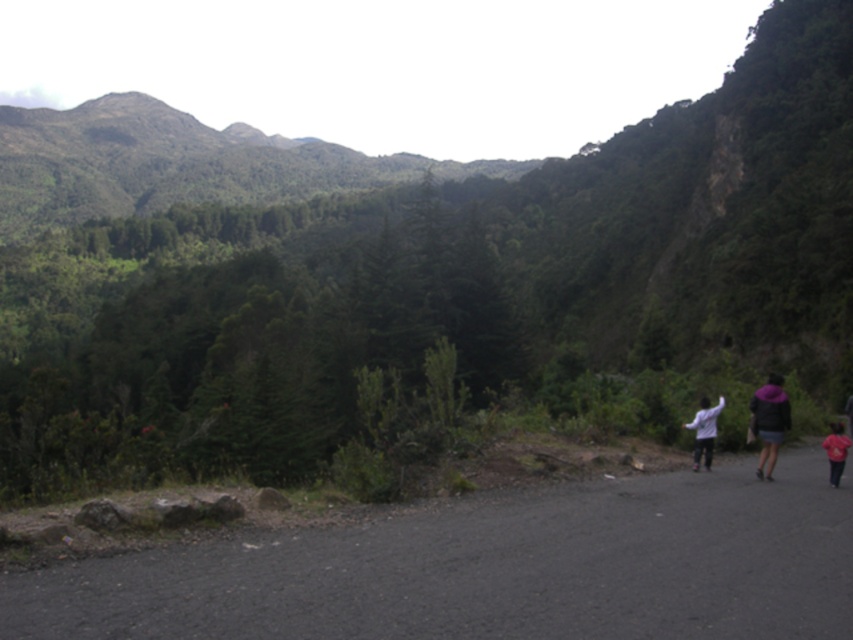
Does white matte jacket at center-right have a smaller size compared to red cotton shirt at right?

Yes.

What do you see at coordinates (704, 429) in the screenshot? I see `white matte jacket at center-right` at bounding box center [704, 429].

Which is in front, point (706, 410) or point (834, 428)?

Point (834, 428) is in front.

Identify the location of white matte jacket at center-right. (704, 429).

Who is more forward, (x=262, y=548) or (x=698, y=456)?

Positioned in front is point (x=262, y=548).

From the picture: Which of these two, black asphalt road at center or white matte jacket at center-right, stands shorter?

black asphalt road at center

Measure the distance between point [354,579] and camera.

The distance of point [354,579] from camera is 6.75 meters.

This screenshot has width=853, height=640. Find the location of `black asphalt road at center`. black asphalt road at center is located at coordinates (492, 568).

Looking at this image, between black asphalt road at center and white cotton shirt at right, which one has more height?

white cotton shirt at right

This screenshot has width=853, height=640. What are the coordinates of `black asphalt road at center` in the screenshot? It's located at (492, 568).

This screenshot has height=640, width=853. What are the coordinates of `black asphalt road at center` in the screenshot? It's located at (492, 568).

Find the location of `black asphalt road at center`. black asphalt road at center is located at coordinates (492, 568).